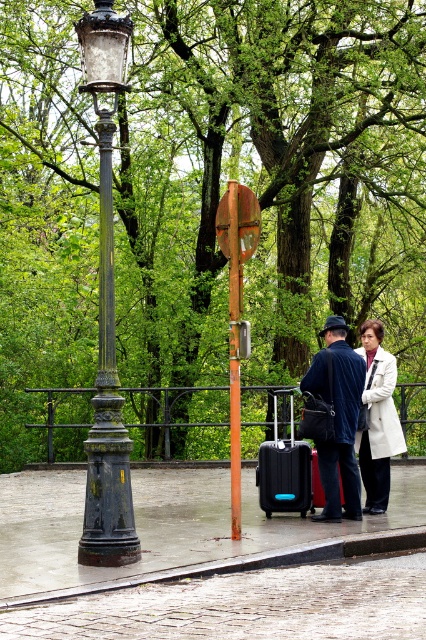
Question: Can you confirm if black hard suitcase at center is wider than black matte suitcase at center?

Choices:
 (A) yes
 (B) no

Answer: (A)

Question: Which object is positioned closest to the black matte suitcase at center?

Choices:
 (A) black hard suitcase at center
 (B) cobblestone pavement at lower center
 (C) white matte coat at center
 (D) concrete pavement at center

Answer: (A)

Question: Which object is farther from the camera taking this photo?

Choices:
 (A) dark blue fabric coat at center
 (B) black polished metal streetlamp at left

Answer: (A)

Question: Which point is closer to the camera taking this photo?

Choices:
 (A) (294, 512)
 (B) (181, 532)
 (C) (365, 433)
 (D) (308, 380)

Answer: (B)

Question: Where is cobblestone pavement at lower center located in relation to black hard suitcase at center in the image?

Choices:
 (A) left
 (B) right

Answer: (B)

Question: Is cobblestone pavement at lower center to the left of black matte suitcase at center from the viewer's perspective?

Choices:
 (A) yes
 (B) no

Answer: (A)